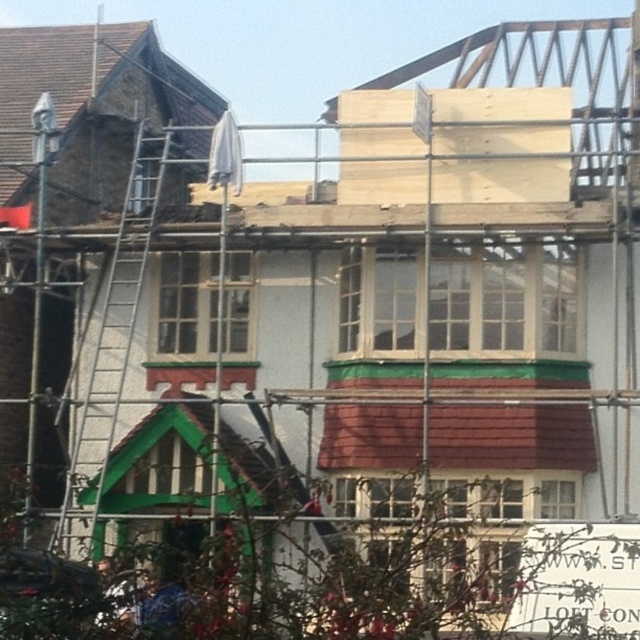
Question: Is brown shingles at upper left smaller than silver metallic ladder at left?

Choices:
 (A) no
 (B) yes

Answer: (B)

Question: Which point is farther to the camera?

Choices:
 (A) brown shingles at upper left
 (B) silver metallic ladder at left

Answer: (A)

Question: Does brown shingles at upper left have a larger size compared to silver metallic ladder at left?

Choices:
 (A) yes
 (B) no

Answer: (B)

Question: Can you confirm if brown shingles at upper left is positioned above silver metallic ladder at left?

Choices:
 (A) yes
 (B) no

Answer: (A)